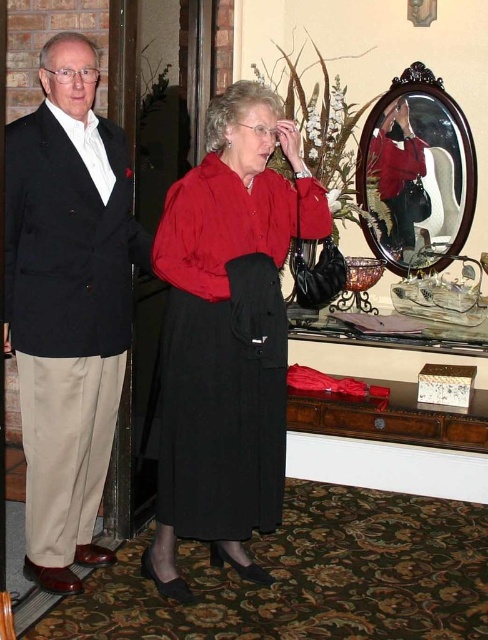
Question: Can you confirm if velvet red dress at center is positioned above wooden oval mirror at upper center?

Choices:
 (A) yes
 (B) no

Answer: (B)

Question: Which of the following is the farthest from the observer?

Choices:
 (A) matte black suit at left
 (B) wooden oval mirror at upper center

Answer: (B)

Question: Does matte black blazer at left have a greater width compared to wooden oval mirror at upper center?

Choices:
 (A) yes
 (B) no

Answer: (B)

Question: Which of the following is the closest to the observer?

Choices:
 (A) (215, 388)
 (B) (9, 237)
 (C) (232, 106)
 (D) (429, 83)

Answer: (C)

Question: Can you confirm if matte black blazer at left is wider than velvet red dress at center?

Choices:
 (A) no
 (B) yes

Answer: (A)

Question: Which object is farther from the camera taking this photo?

Choices:
 (A) wooden oval mirror at upper center
 (B) matte black suit at left
 (C) matte black blazer at left

Answer: (A)